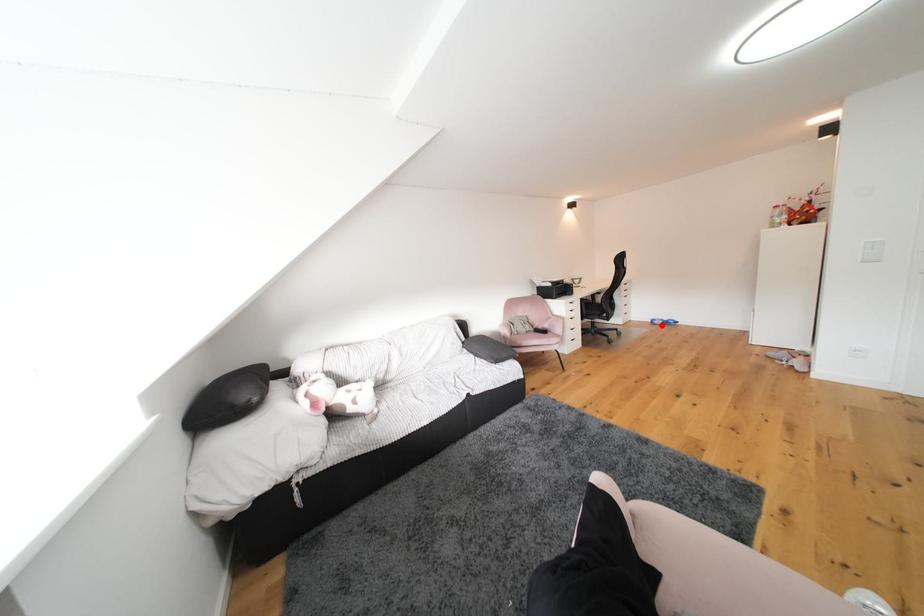
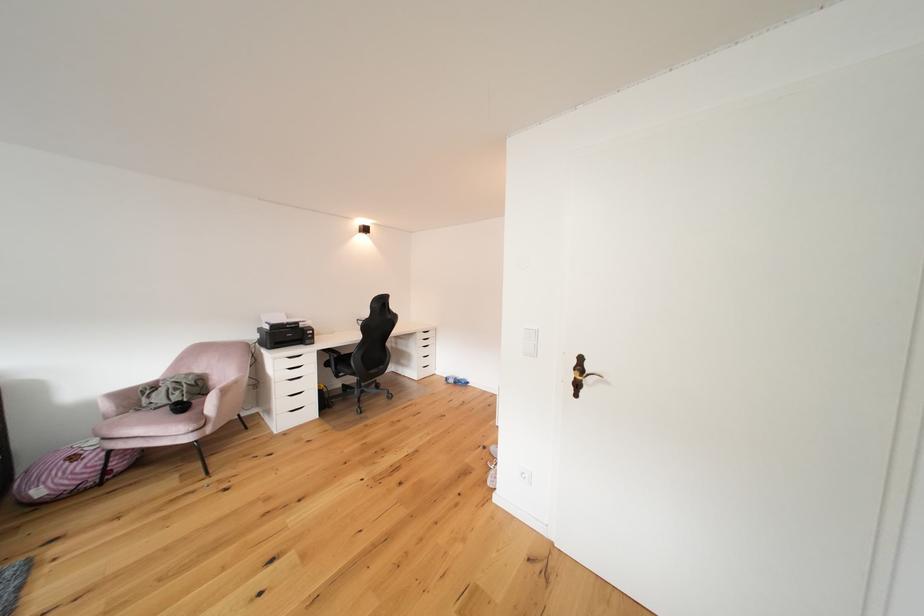
In the second image, find the point that corresponds to the highlighted location in the first image.

(456, 383)